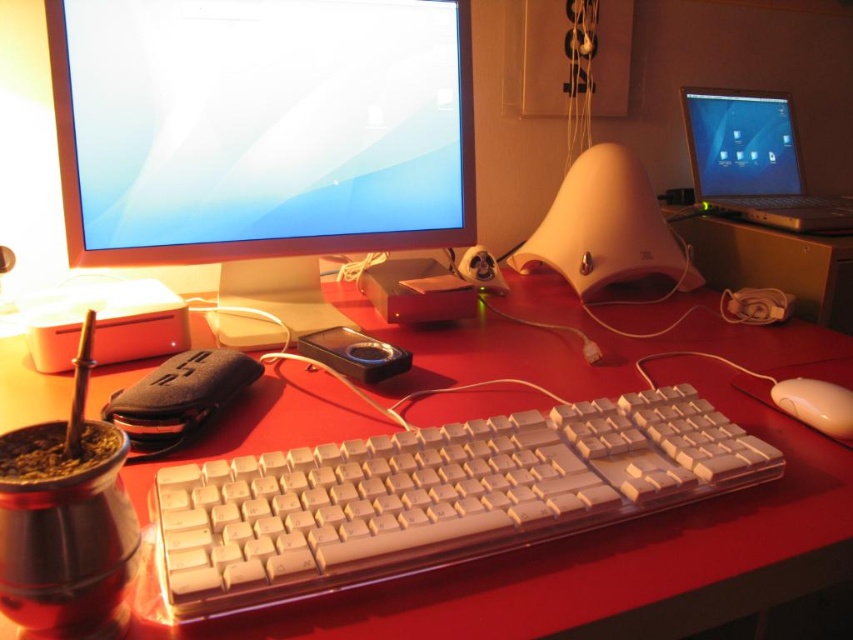
You are setting up a new monitor in your workspace. The recommended distance between the monitor and your eyes is between 20 to 24 inches. Based on the image, will the white plastic monitor at upper left be positioned at a safe distance according to the guidelines?

The white plastic monitor at upper left is 29.29 inches away from the camera, which exceeds the recommended 24 inches. Therefore, it is positioned beyond the safe distance range.

From the picture: You need to place a 12cm wide notebook between the white plastic keyboard at center and the metallic silver laptop at upper right. Is there enough space?

The white plastic keyboard at center is wider than the metallic silver laptop at upper right, so the space between them might be sufficient for a 12cm wide notebook. However, without exact measurements, it is uncertain. Please check the actual distance.

You are setting up a new desk and want to arrange items according to their sizes. You have a white plastic keyboard at center and a metallic silver laptop at upper right. Which object should you place first if you need to accommodate the larger item in your setup?

The metallic silver laptop at upper right is larger than the white plastic keyboard at center, so you should place the metallic silver laptop at upper right first to ensure there is enough space for it.